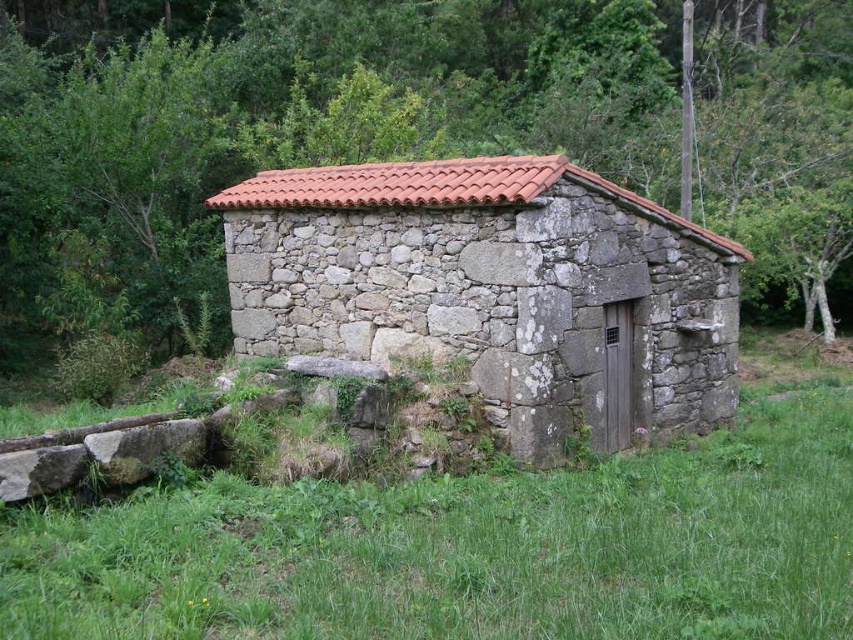
You are a hiker who wants to take shelter from the rain in the stone textured hut at center. However, there is a green leafy tree at center blocking the entrance. Can you enter the hut easily?

The green leafy tree at center is larger than the stone textured hut at center, so it might block the entrance. You might need to move branches or find another way in.